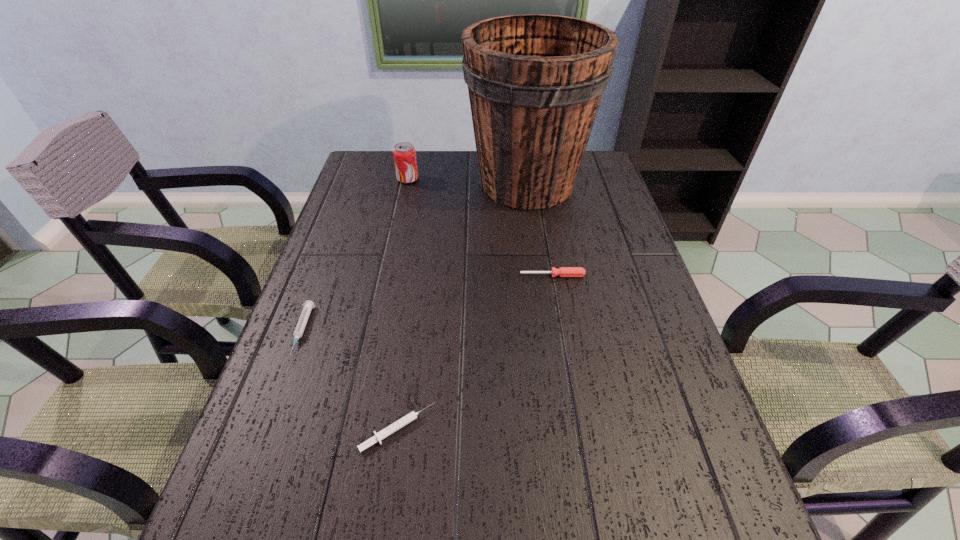
Locate an element on the screen. This screenshot has width=960, height=540. free space at the far edge is located at coordinates tap(461, 174).

At what (x,y) coordinates should I click in order to perform the action: click on vacant region at the left edge of the desktop. Please return your answer as a coordinate pair (x, y). The height and width of the screenshot is (540, 960). Looking at the image, I should click on (348, 188).

Where is `vacant space at the right edge of the desktop`? vacant space at the right edge of the desktop is located at coordinates (718, 445).

This screenshot has height=540, width=960. Identify the location of vacant space at the far right corner of the desktop. (587, 172).

I want to click on free space between the fourth farthest object and the soda can, so click(355, 255).

Identify the location of free space between the second nearest object and the screwdriver. The width and height of the screenshot is (960, 540). [427, 303].

Locate an element on the screen. The height and width of the screenshot is (540, 960). free space between the tallest object and the farther syringe is located at coordinates (415, 258).

The width and height of the screenshot is (960, 540). Identify the location of free point between the bucket and the soda can. (468, 181).

Find the location of a particular element. This screenshot has height=540, width=960. free space between the nearest object and the soda can is located at coordinates (402, 303).

Where is `free space between the nearest object and the farther syringe`? The height and width of the screenshot is (540, 960). free space between the nearest object and the farther syringe is located at coordinates (349, 380).